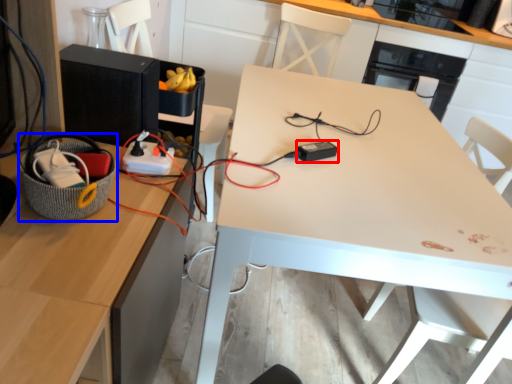
Question: Which of the following is the farthest to the observer, appliance (highlighted by a red box) or basket (highlighted by a blue box)?

Choices:
 (A) appliance
 (B) basket

Answer: (A)